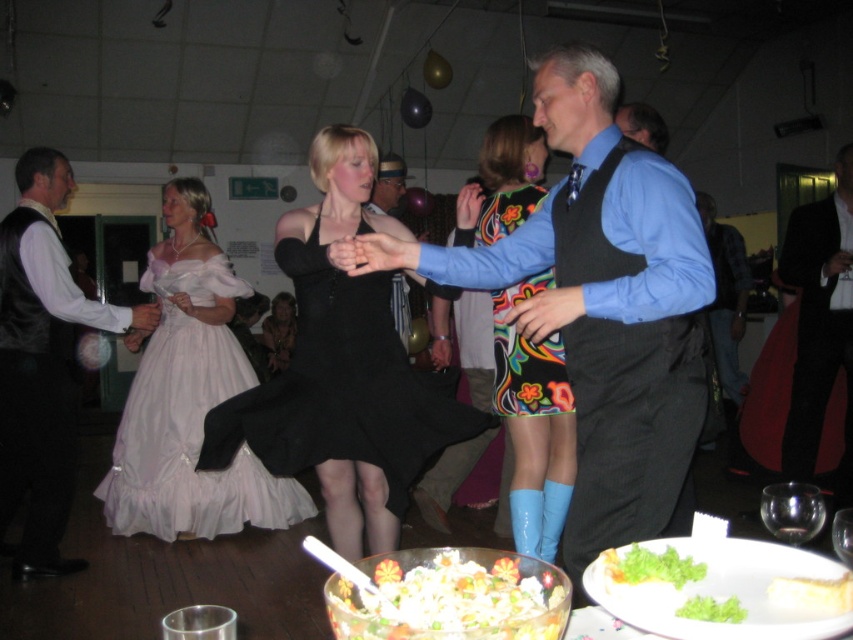
The image size is (853, 640). What do you see at coordinates (42, 362) in the screenshot?
I see `black satin vest at left` at bounding box center [42, 362].

Is black satin vest at left bigger than green leafy salad at lower center?

Indeed, black satin vest at left has a larger size compared to green leafy salad at lower center.

Describe the element at coordinates (42, 362) in the screenshot. I see `black satin vest at left` at that location.

The image size is (853, 640). In order to click on black satin vest at left in this screenshot , I will do `click(42, 362)`.

Does white creamy salad at lower center have a smaller size compared to white creamy cake at lower right?

Actually, white creamy salad at lower center might be larger than white creamy cake at lower right.

Who is positioned more to the left, white creamy salad at lower center or white creamy cake at lower right?

From the viewer's perspective, white creamy salad at lower center appears more on the left side.

Does point (523, 614) come in front of point (788, 592)?

That is True.

I want to click on white creamy salad at lower center, so click(x=451, y=595).

Is floral print dress at center further to the viewer compared to velvet black dress at center?

No, it is not.

This screenshot has height=640, width=853. Find the location of `floral print dress at center`. floral print dress at center is located at coordinates (531, 419).

At what (x,y) coordinates should I click in order to perform the action: click on floral print dress at center. Please return your answer as a coordinate pair (x, y). The image size is (853, 640). Looking at the image, I should click on (531, 419).